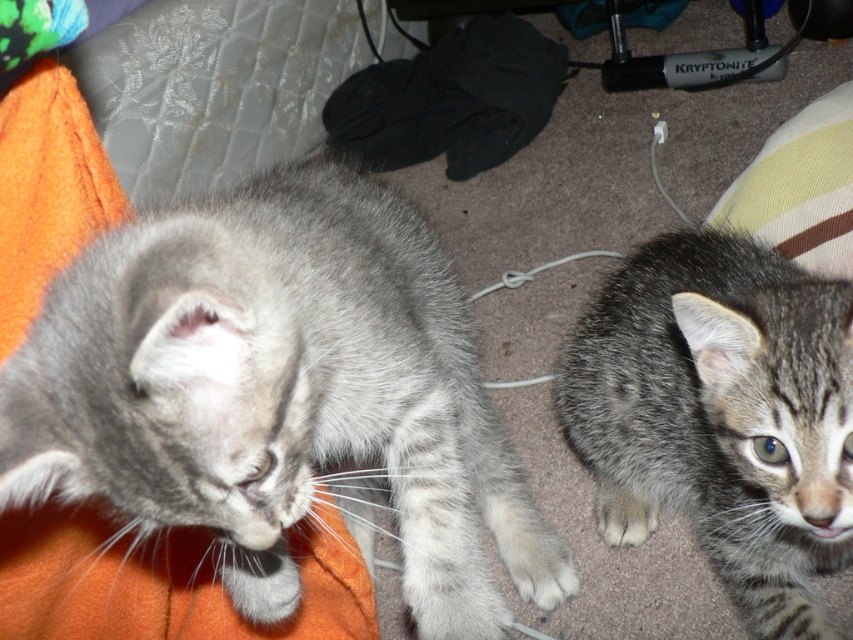
You are a photographer trying to capture a photo of both the fuzzy gray cat at upper left and the white fur at lower right. Since you want to include both subjects in the frame, can you determine which direction you should position your camera to ensure both are visible?

The fuzzy gray cat at upper left is above white fur at lower right, so positioning the camera to face downward from the upper left towards the lower right will ensure both subjects are visible in the frame.

You are a photographer trying to capture a closeup shot of the kitten on the left. You notice two points in the image labeled as point 1 at coordinates point [723,442] and point 2 at coordinates point [230,6]. Which point should you focus on to ensure the kitten on the left is in focus?

You should focus on point 1 at coordinates point [723,442] because it is closer to the viewer than point 2 at coordinates point [230,6], ensuring the kitten on the left is in focus.

You are a photographer trying to capture a closeup shot of the tabby fur cat at center. The camera you are using has a focal length of 50mm. Based on the coordinates provided, can you determine if the cat is positioned within the frame of the camera?

The tabby fur cat at center is located at point coordinates of [724,410], which falls within the camera frame. Therefore, the cat is positioned within the frame.